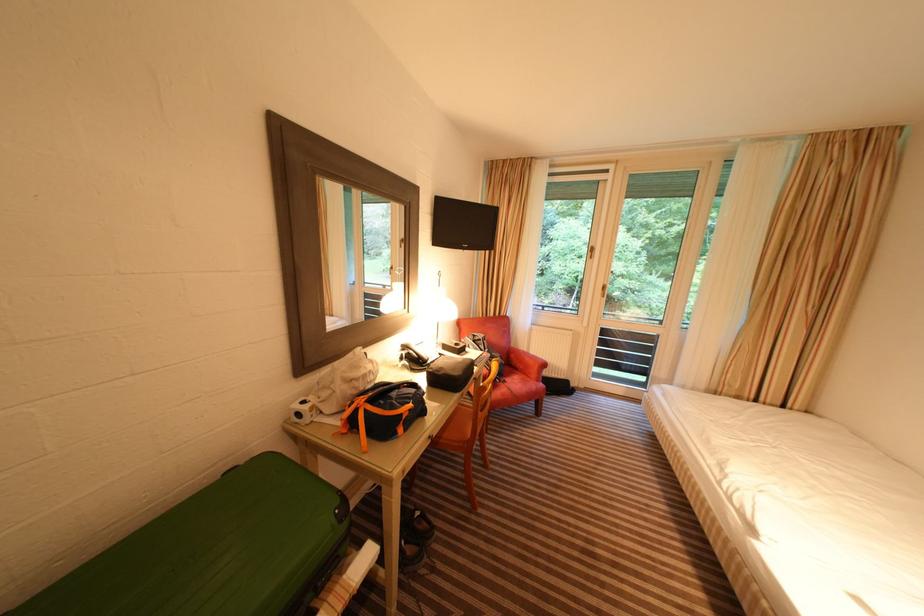
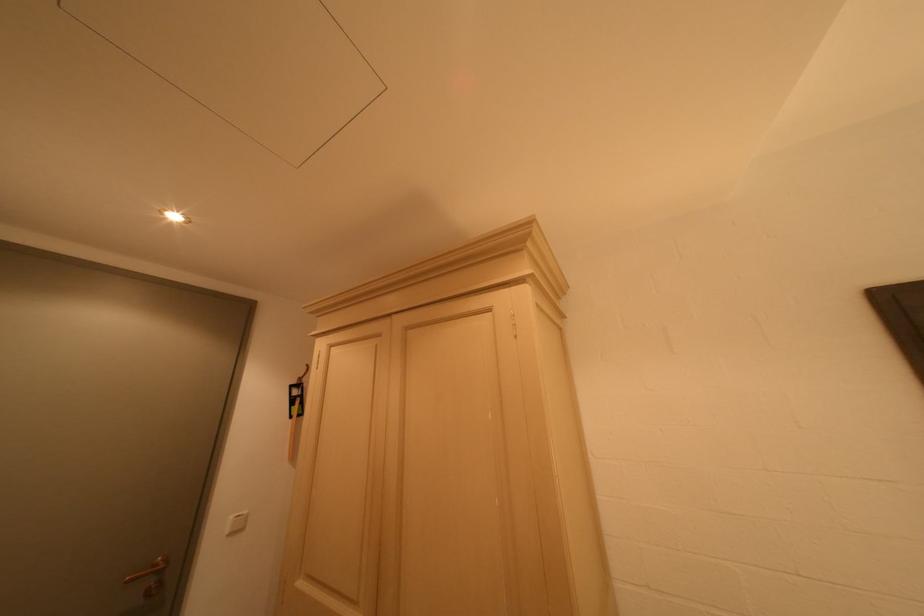
Based on the photo, the images are taken continuously from a first-person perspective. In which direction is your viewpoint rotating?

The camera's rotation is toward left-up.